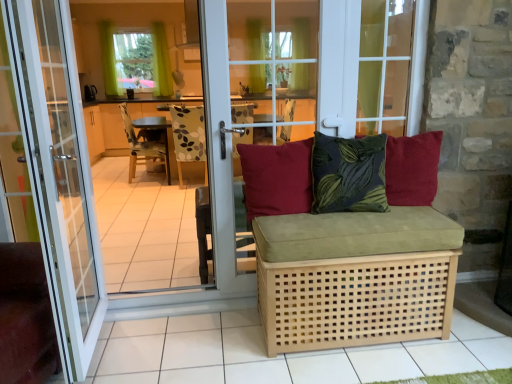
You are a GUI agent. You are given a task and a screenshot of the screen. Output one action in this format:
    pyautogui.click(x=<x>, y=<y>)
    Task: Click on the vacant region under white glass door at center (from a real-world perspective)
    The height and width of the screenshot is (384, 512).
    Given the screenshot: What is the action you would take?
    pyautogui.click(x=108, y=340)